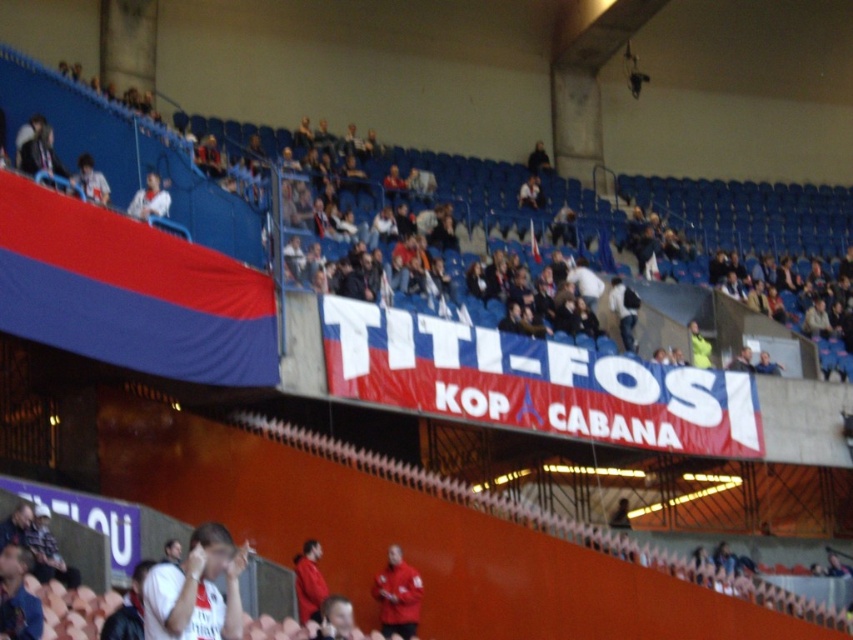
You are a photographer at the stadium and want to capture both the matte red jacket at center and the white fabric shirt at upper left in the same frame. Which object should you adjust your camera to focus on first to ensure both are in the shot?

You should focus on the matte red jacket at center first because it is to the right of the white fabric shirt at upper left, so adjusting the frame to include both requires starting from the right side.

You are a photographer standing at the center of the stadium, aiming to capture a photo of both the white matte shirt at center and the red matte jacket at center. If your camera has a maximum focus range of 30 feet, will both subjects be in focus?

The white matte shirt at center is 31.21 feet from the red matte jacket at center. Since the camera can only focus up to 30 feet, the distance between them exceeds the maximum range. Therefore, both subjects cannot be in focus simultaneously.